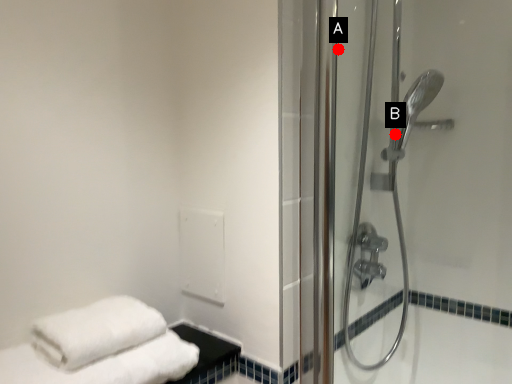
Question: Two points are circled on the image, labeled by A and B beside each circle. Which point appears closest to the camera in this image?

Choices:
 (A) A is closer
 (B) B is closer

Answer: (A)